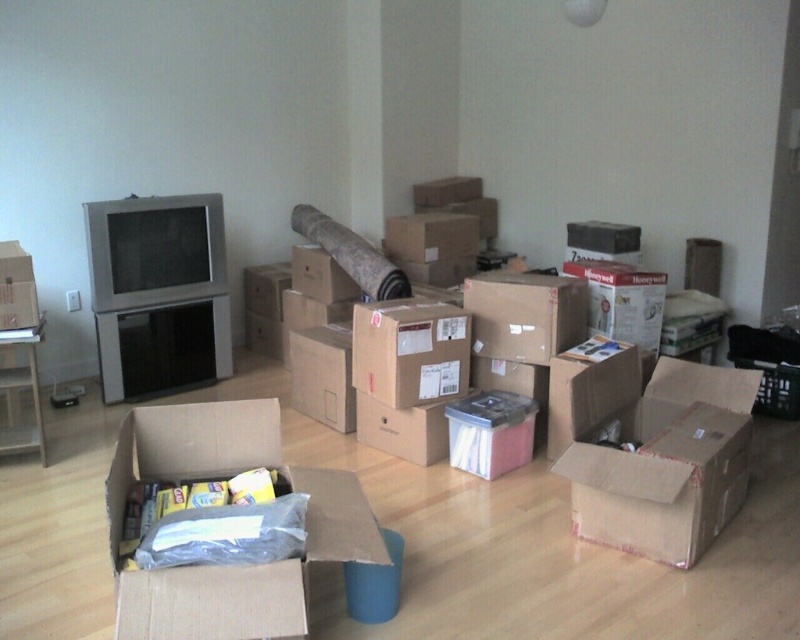
Question: Is cardboard box at center closer to camera compared to matte cardboard box at left?

Choices:
 (A) yes
 (B) no

Answer: (A)

Question: Which point is closer to the camera?

Choices:
 (A) cardboard box at center
 (B) matte cardboard box at left

Answer: (A)

Question: Does cardboard box at center have a smaller size compared to matte cardboard box at left?

Choices:
 (A) no
 (B) yes

Answer: (A)

Question: Where is cardboard box at center located in relation to matte cardboard box at left in the image?

Choices:
 (A) right
 (B) left

Answer: (A)

Question: Which point is farther to the camera?

Choices:
 (A) (294, 572)
 (B) (12, 296)

Answer: (B)